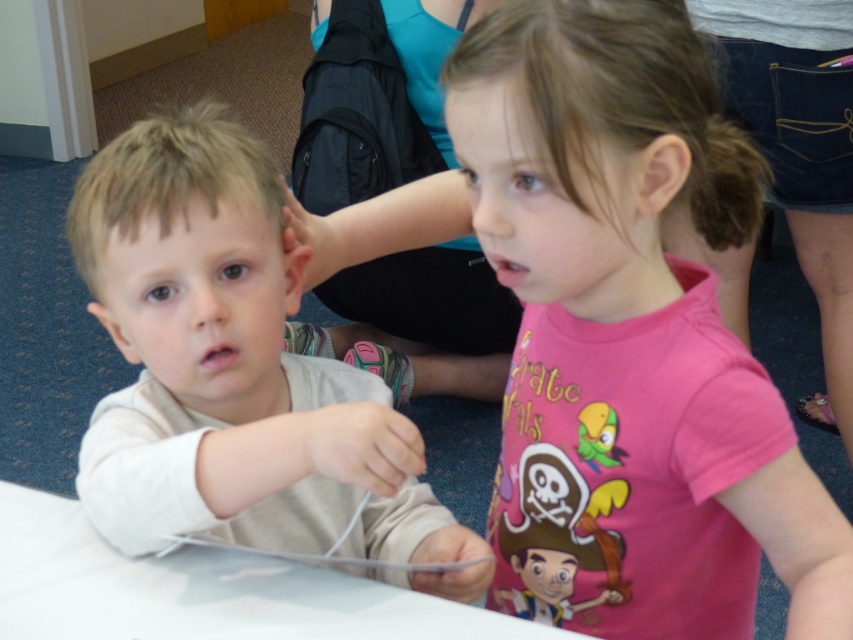
Question: Is pink cotton shirt at center further to camera compared to light beige shirt at left?

Choices:
 (A) yes
 (B) no

Answer: (B)

Question: Among these points, which one is farthest from the camera?

Choices:
 (A) [175, 371]
 (B) [548, 168]

Answer: (A)

Question: Which point appears farthest from the camera in this image?

Choices:
 (A) (752, 157)
 (B) (76, 260)

Answer: (B)

Question: Is pink cotton shirt at center below light beige shirt at left?

Choices:
 (A) no
 (B) yes

Answer: (A)

Question: Is pink cotton shirt at center bigger than light beige shirt at left?

Choices:
 (A) no
 (B) yes

Answer: (B)